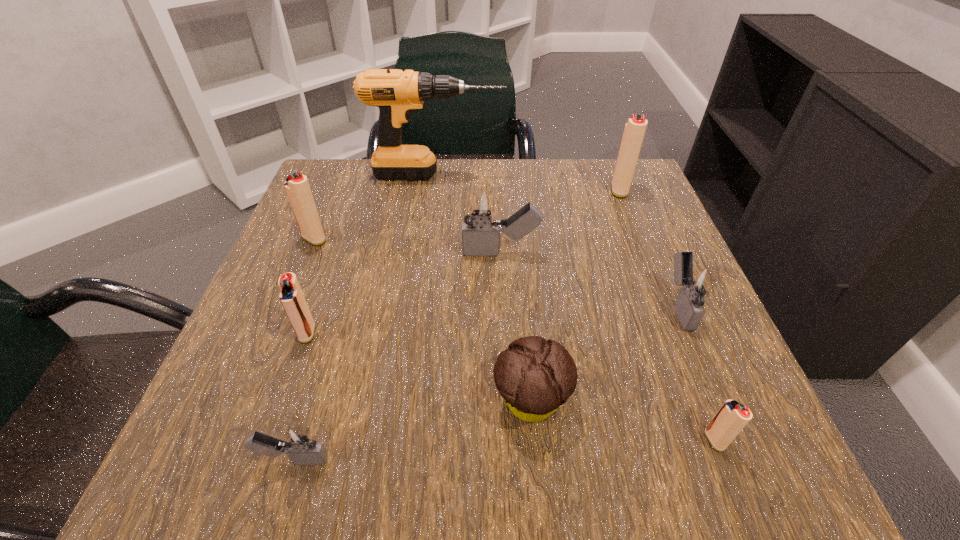
In order to click on vacant area situated 0.080m on the right of the third farthest red igniter in this screenshot , I will do `click(365, 333)`.

Locate an element on the screen. The height and width of the screenshot is (540, 960). free space located on the left of the chocolate muffin is located at coordinates (457, 402).

Where is `blank area located 0.380m on the left of the nearest red igniter`? blank area located 0.380m on the left of the nearest red igniter is located at coordinates (420, 440).

In order to click on vacant area situated on the right of the nearest gray igniter in this screenshot , I will do `click(546, 460)`.

Where is `drill that is at the far edge`? The image size is (960, 540). drill that is at the far edge is located at coordinates (396, 93).

Image resolution: width=960 pixels, height=540 pixels. In order to click on igniter positioned at the far edge in this screenshot , I will do `click(635, 128)`.

Image resolution: width=960 pixels, height=540 pixels. I want to click on muffin at the near edge, so click(535, 377).

Where is `drill that is at the left edge`? drill that is at the left edge is located at coordinates (396, 93).

This screenshot has height=540, width=960. What are the coordinates of `object located in the far left corner section of the desktop` in the screenshot? It's located at [x=396, y=93].

This screenshot has width=960, height=540. I want to click on object situated at the near left corner, so click(x=297, y=441).